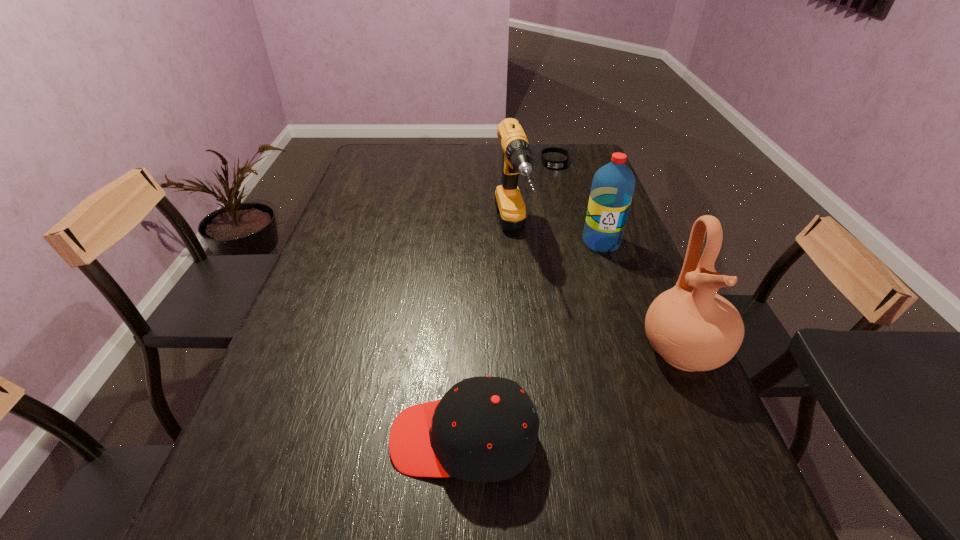
Locate an element on the screen. This screenshot has width=960, height=540. cap is located at coordinates (484, 429).

I want to click on the second shortest object, so click(484, 429).

At what (x,y) coordinates should I click in order to perform the action: click on the second nearest object. Please return your answer as a coordinate pair (x, y). The height and width of the screenshot is (540, 960). Looking at the image, I should click on (692, 328).

This screenshot has width=960, height=540. I want to click on wristband, so click(x=549, y=164).

Identify the location of the shortest object. (549, 164).

Locate an element on the screen. The height and width of the screenshot is (540, 960). drill is located at coordinates (517, 159).

This screenshot has height=540, width=960. I want to click on water bottle, so click(x=613, y=185).

Where is `vacant region located 0.160m on the front-facing side of the cap`? vacant region located 0.160m on the front-facing side of the cap is located at coordinates (305, 438).

Locate an element on the screen. free space located on the front-facing side of the cap is located at coordinates (252, 438).

Find the location of a particular element. The width and height of the screenshot is (960, 540). vacant space positioned 0.060m on the front-facing side of the cap is located at coordinates (359, 438).